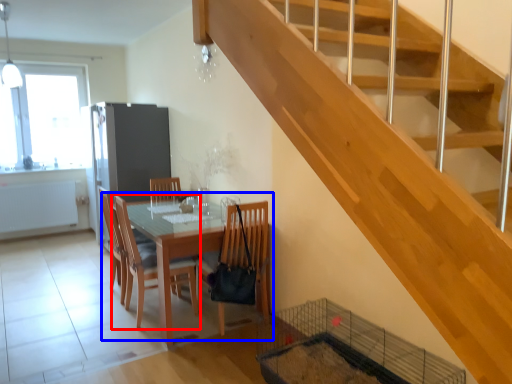
Question: Which point is closer to the camera, chair (highlighted by a red box) or kitchen & dining room table (highlighted by a blue box)?

Choices:
 (A) chair
 (B) kitchen & dining room table

Answer: (B)